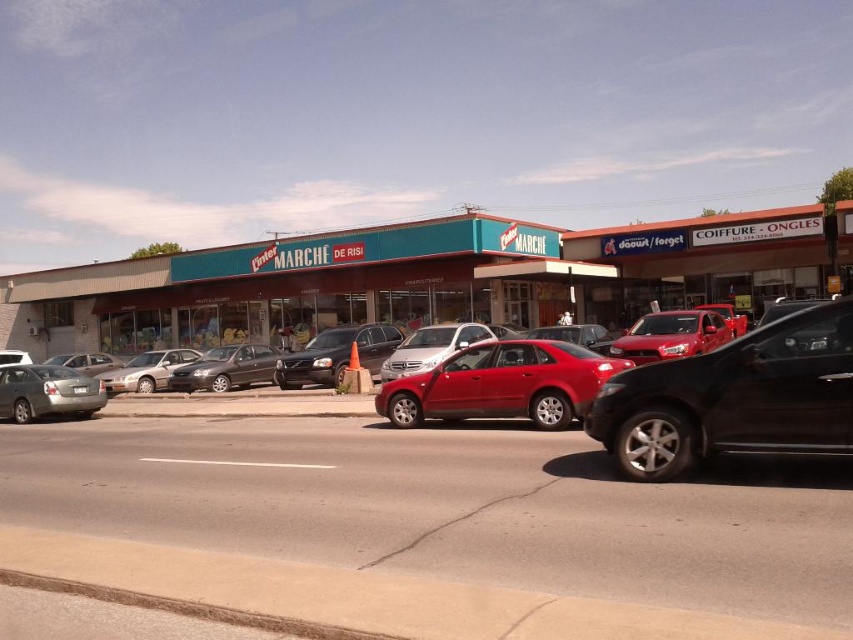
Question: Which point is farther to the camera?

Choices:
 (A) (445, 620)
 (B) (581, 410)
 (C) (686, 451)

Answer: (B)

Question: Which point appears farthest from the camera in this image?

Choices:
 (A) (79, 356)
 (B) (656, 337)
 (C) (555, 428)
 (D) (293, 385)

Answer: (A)

Question: Is satin silver sedan at left behind satin silver sedan at center?

Choices:
 (A) no
 (B) yes

Answer: (B)

Question: Which of the following is the closest to the observer?

Choices:
 (A) glossy red sedan at center
 (B) metallic gray sedan at center-left
 (C) satin silver sedan at center
 (D) matte silver sedan at center-left

Answer: (A)

Question: Considering the relative positions of teal plastic building at center and satin silver sedan at center in the image provided, where is teal plastic building at center located with respect to satin silver sedan at center?

Choices:
 (A) right
 (B) left

Answer: (B)

Question: Is satin silver sedan at left positioned before matte silver sedan at center-left?

Choices:
 (A) no
 (B) yes

Answer: (B)